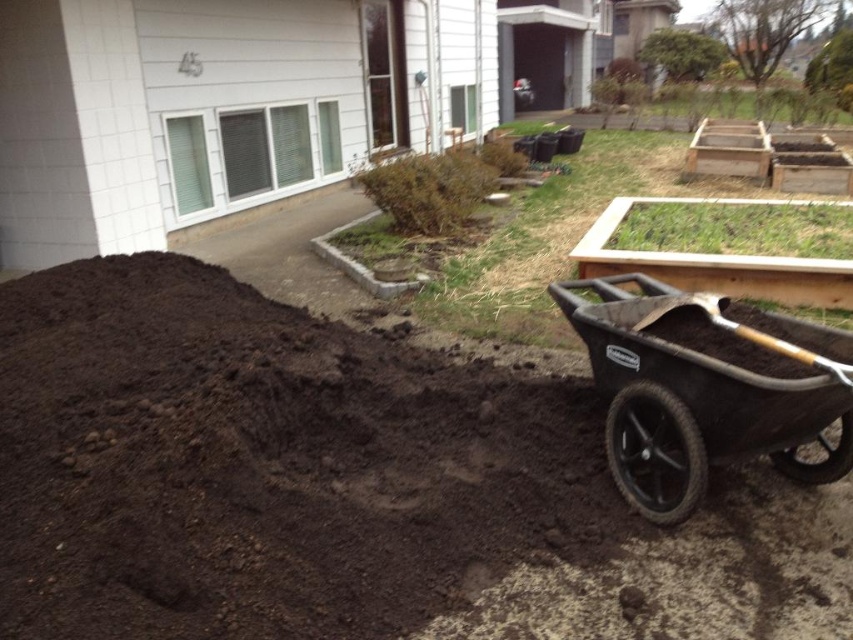
You are a gardener who needs to transport the dark brown soil at center and the wooden shovel at lower right using a container that can only hold items narrower than the shovel. Which item should you prioritize moving first?

The wooden shovel at lower right is narrower than the dark brown soil at center, so you should prioritize moving the wooden shovel at lower right first since it fits within the container width limit.

You are a gardener who needs to transport the dark brown soil at center to the raised garden beds. Given the size of the black rubber wheelbarrow at lower right, can you estimate how many trips you might need to move all the soil?

The dark brown soil at center is wider than the black rubber wheelbarrow at lower right, so you would need multiple trips to transport all the soil.